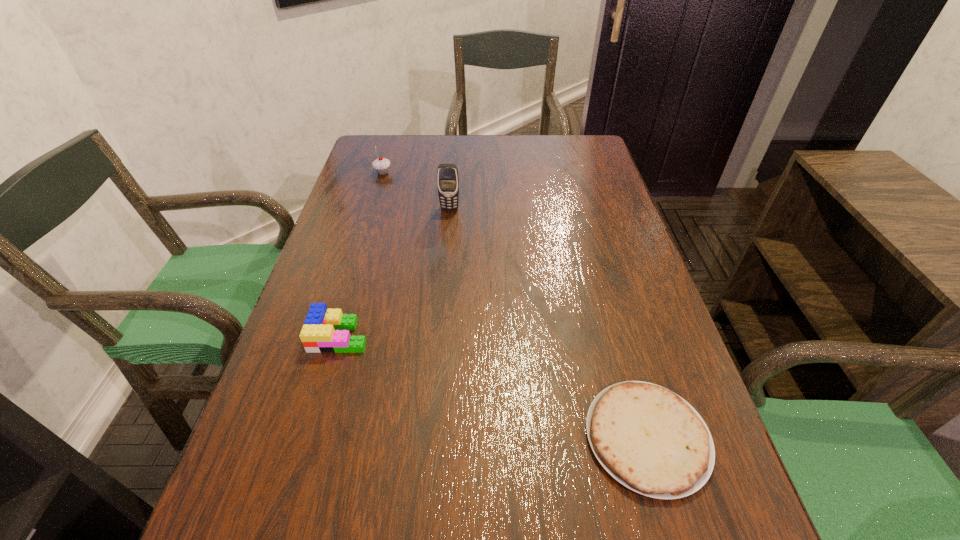
I want to click on vacant area that lies between the Lego and the rightmost object, so click(493, 387).

Identify the location of unoccupied area between the tortilla and the cupcake. The width and height of the screenshot is (960, 540). (515, 305).

Identify the location of empty space that is in between the tortilla and the cupcake. This screenshot has height=540, width=960. (515, 305).

Identify the location of vacant space that is in between the second tallest object and the second farthest object. (417, 191).

This screenshot has width=960, height=540. What are the coordinates of `vacant area that lies between the second shortest object and the tallest object` in the screenshot? It's located at (395, 272).

Where is `free spot between the Lego and the farthest object`? free spot between the Lego and the farthest object is located at coordinates (361, 254).

This screenshot has width=960, height=540. What are the coordinates of `empty location between the cellular telephone and the nearest object` in the screenshot? It's located at (548, 323).

This screenshot has width=960, height=540. I want to click on vacant area that lies between the third farthest object and the rightmost object, so click(x=493, y=387).

The height and width of the screenshot is (540, 960). Find the location of `free space between the Lego and the rightmost object`. free space between the Lego and the rightmost object is located at coordinates (493, 387).

Where is `unoccupied area between the tortilla and the second farthest object`? unoccupied area between the tortilla and the second farthest object is located at coordinates (548, 323).